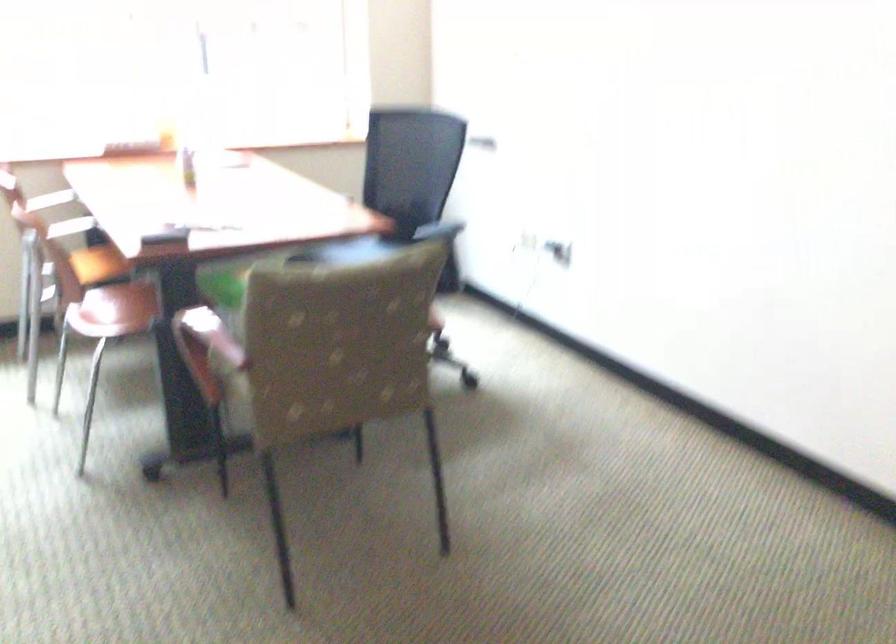
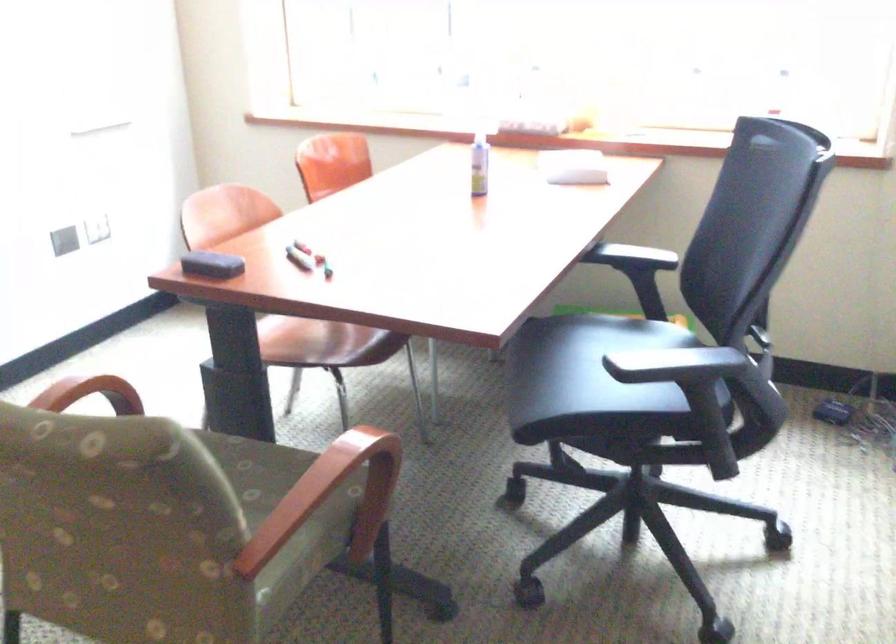
Locate, in the second image, the point that corresponds to (193,315) in the first image.

(90, 393)